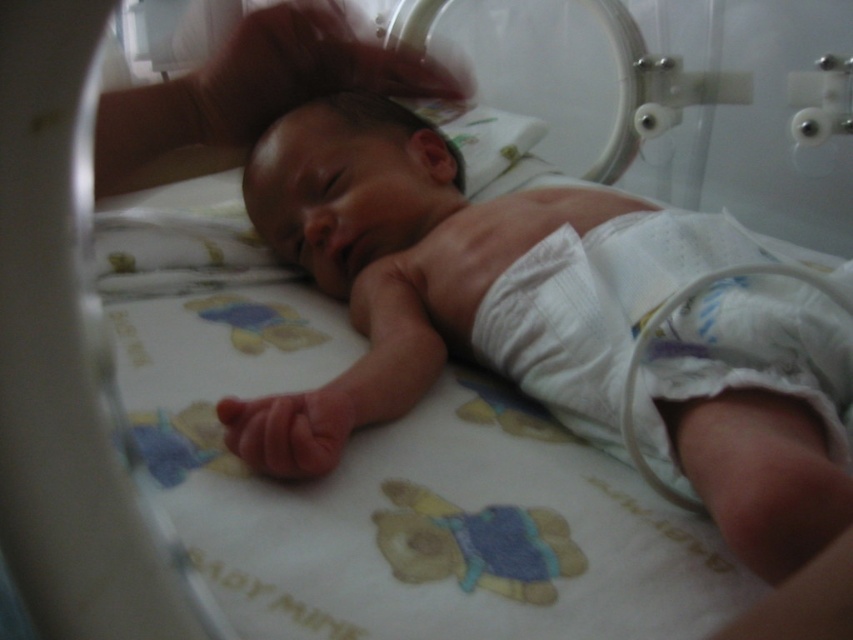
Question: Which of the following is the farthest from the observer?

Choices:
 (A) (781, 372)
 (B) (737, 497)

Answer: (A)

Question: Does smooth white newborn at center lie in front of white cloth diaper at lower right?

Choices:
 (A) no
 (B) yes

Answer: (B)

Question: From the image, what is the correct spatial relationship of smooth white newborn at center in relation to white cloth diaper at lower right?

Choices:
 (A) above
 (B) below

Answer: (A)

Question: Which of the following is the closest to the observer?

Choices:
 (A) (815, 273)
 (B) (830, 349)

Answer: (B)

Question: Is smooth white newborn at center bigger than white cloth diaper at lower right?

Choices:
 (A) no
 (B) yes

Answer: (B)